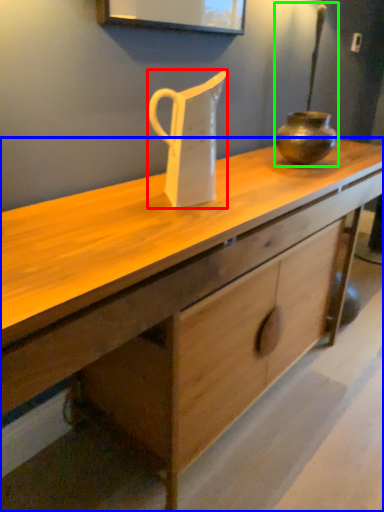
Question: Based on their relative distances, which object is nearer to jug (highlighted by a red box)? Choose from desk (highlighted by a blue box) and candle holder (highlighted by a green box).

Choices:
 (A) desk
 (B) candle holder

Answer: (A)